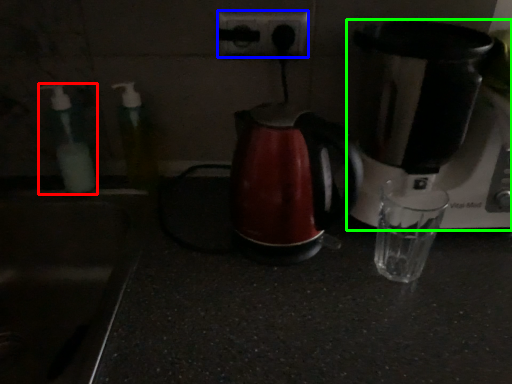
Question: Which object is positioned closest to bottle (highlighted by a red box)? Select from power plugs and sockets (highlighted by a blue box) and coffee maker (highlighted by a green box).

Choices:
 (A) power plugs and sockets
 (B) coffee maker

Answer: (A)